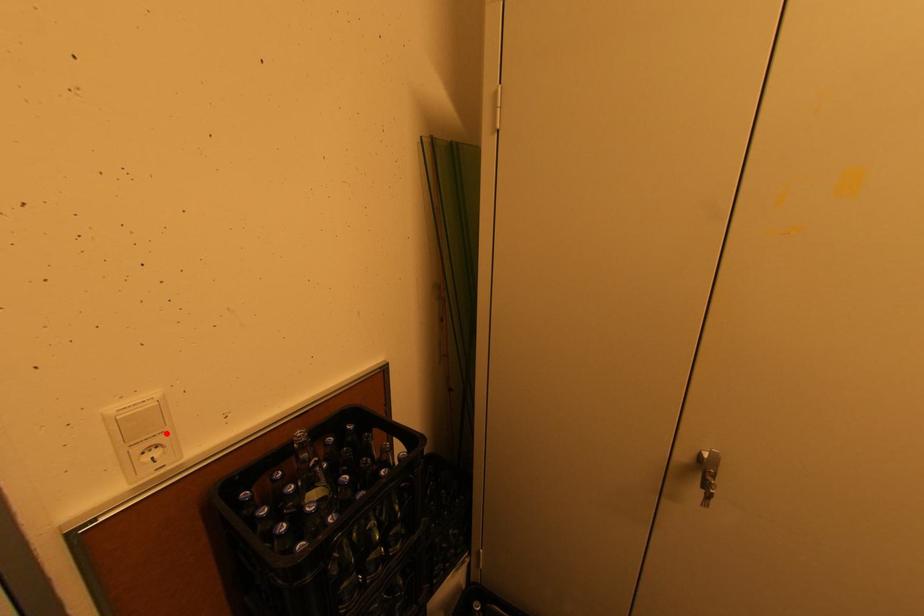
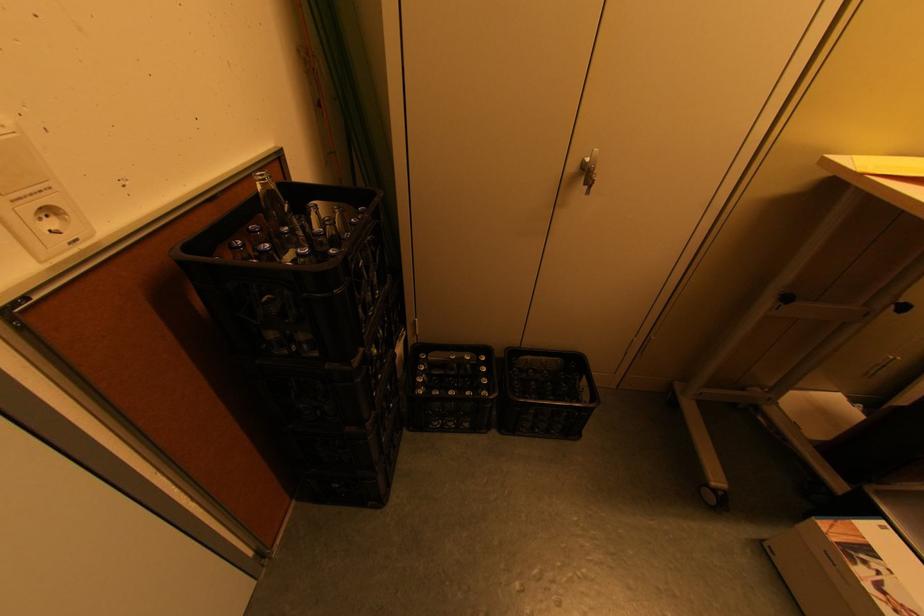
Where in the second image is the point corresponding to the highlighted location from the first image?

(54, 188)